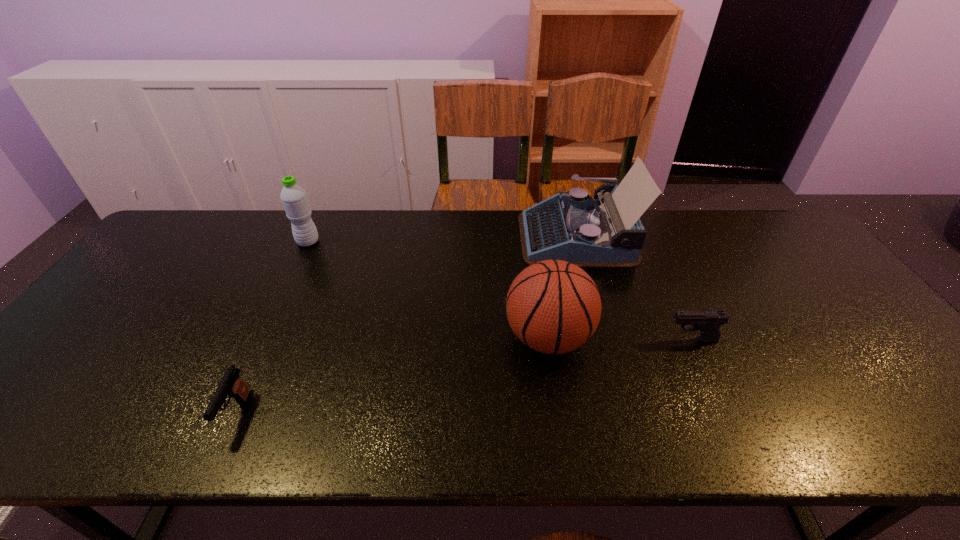
In order to click on free space at the near edge of the desktop in this screenshot , I will do `click(385, 413)`.

The image size is (960, 540). In order to click on free space at the left edge of the desktop in this screenshot , I will do `click(95, 364)`.

This screenshot has height=540, width=960. In the image, there is a desktop. Find the location of `vacant space at the right edge`. vacant space at the right edge is located at coordinates (887, 383).

The width and height of the screenshot is (960, 540). In order to click on vacant space at the far left corner in this screenshot , I will do `click(197, 251)`.

Find the location of a particular element. The height and width of the screenshot is (540, 960). free space at the far right corner of the desktop is located at coordinates (756, 231).

Where is `unoccupied area between the typewriter and the nearer pistol`? Image resolution: width=960 pixels, height=540 pixels. unoccupied area between the typewriter and the nearer pistol is located at coordinates (406, 325).

Locate an element on the screen. vacant area between the nearer pistol and the farther pistol is located at coordinates (465, 376).

Identify the location of vacant area that lies between the water bottle and the right pistol. (500, 291).

In order to click on vacant area that lies between the nearest object and the typewriter in this screenshot , I will do `click(406, 325)`.

At what (x,y) coordinates should I click in order to perform the action: click on free space between the typewriter and the right pistol. Please return your answer as a coordinate pair (x, y). This screenshot has height=540, width=960. Looking at the image, I should click on (635, 288).